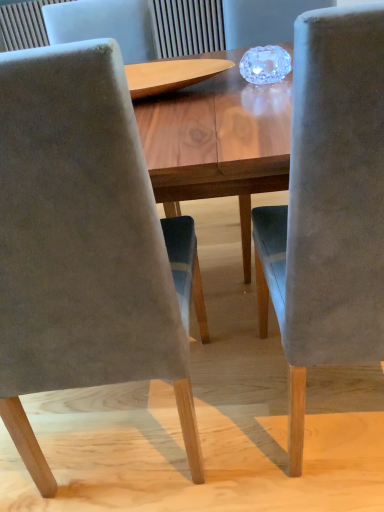
At what (x,y) coordinates should I click in order to perform the action: click on vacant space situated on the left part of velvet gray chair at right, the second chair in the left-to-right sequence. Please return your answer as a coordinate pair (x, y). Image resolution: width=384 pixels, height=512 pixels. Looking at the image, I should click on (241, 418).